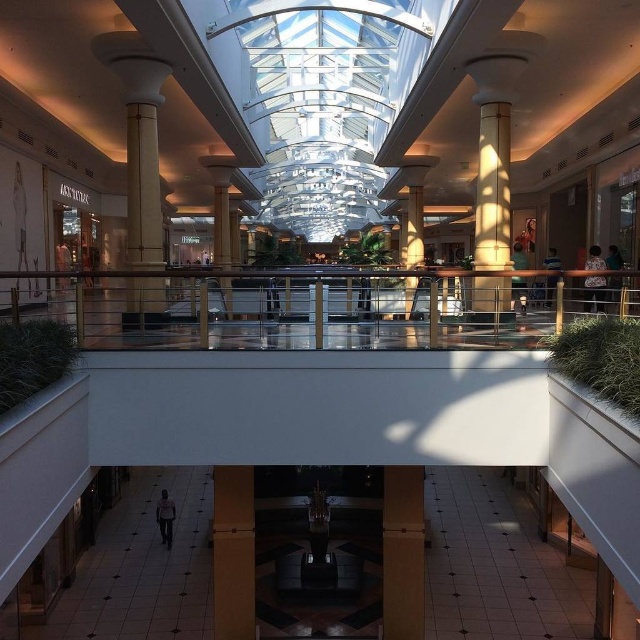
Can you confirm if brown matte pillar at lower center is positioned to the left of white marble pillar at center?

Indeed, brown matte pillar at lower center is positioned on the left side of white marble pillar at center.

Between point (243, 618) and point (412, 208), which one is positioned in front?

Positioned in front is point (243, 618).

Locate an element on the screen. This screenshot has height=640, width=640. brown matte pillar at lower center is located at coordinates (234, 552).

Can you confirm if wooden pillar at center is shorter than matte gold column at center?

Yes.

Is wooden pillar at center wider than matte gold column at center?

No, wooden pillar at center is not wider than matte gold column at center.

Identify the location of wooden pillar at center. (403, 552).

Identify the location of wooden pillar at center. Image resolution: width=640 pixels, height=640 pixels. (403, 552).

Is metallic polished rail at center thinner than smooth beige column at center?

Incorrect, metallic polished rail at center's width is not less than smooth beige column at center's.

Is metallic polished rail at center wider than smooth beige column at center?

Yes, metallic polished rail at center is wider than smooth beige column at center.

Does point (502, 337) come farther from viewer compared to point (236, 163)?

No, (502, 337) is in front of (236, 163).

Where is `metallic polished rail at center`? This screenshot has width=640, height=640. metallic polished rail at center is located at coordinates (305, 308).